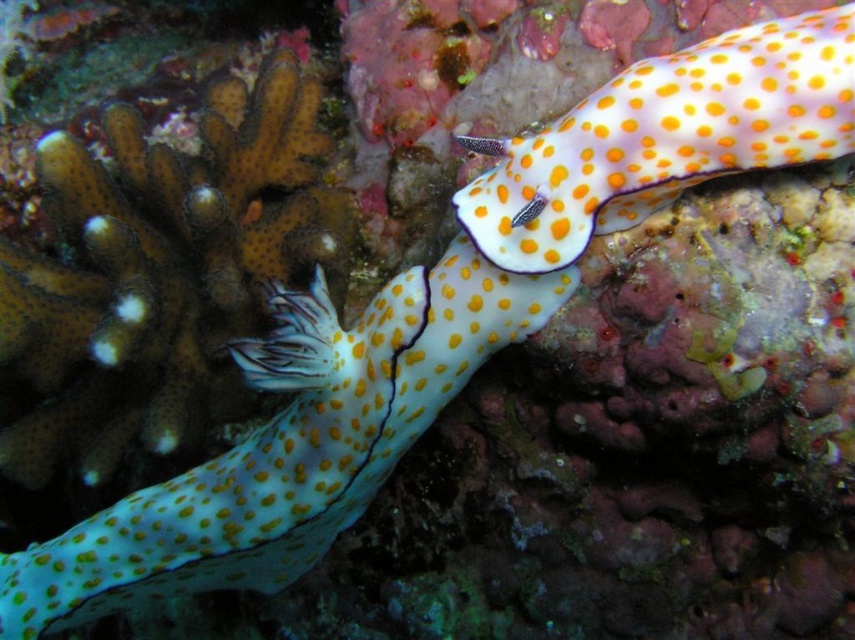
You are a marine biologist observing an underwater scene. You notice a translucent yellow spotted sea slug at center and an orange dotted shell at upper right. Which of these two objects is positioned closer to the left side of the image?

The translucent yellow spotted sea slug at center is positioned closer to the left side of the image because it is to the left of the orange dotted shell at upper right.

You are a marine biologist observing an underwater scene. You notice a point at coordinates (289, 444). Based on the scene description, what organism is located at that point?

The point at coordinates (289, 444) indicates a translucent yellow spotted sea slug at center.